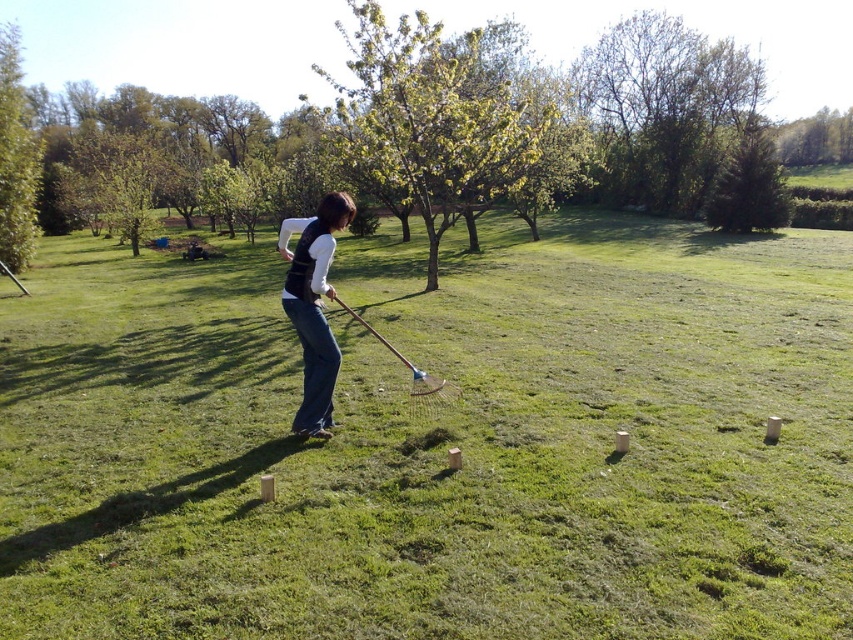
How distant is green grass at center from denim jeans at center?

green grass at center is 21.69 feet away from denim jeans at center.

Is point (177, 326) more distant than point (305, 266)?

That is True.

Which is in front, point (15, 625) or point (347, 220)?

Positioned in front is point (15, 625).

Identify the location of green grass at center. (434, 442).